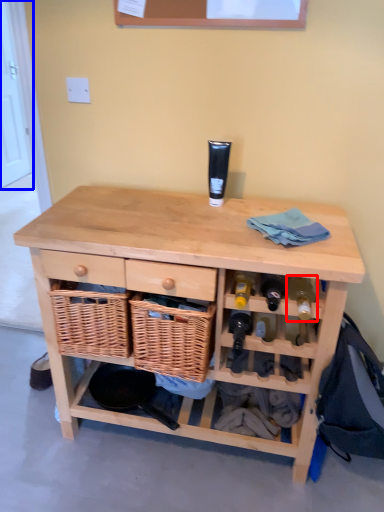
Question: Which object is further to the camera taking this photo, wine bottle (highlighted by a red box) or door (highlighted by a blue box)?

Choices:
 (A) wine bottle
 (B) door

Answer: (B)